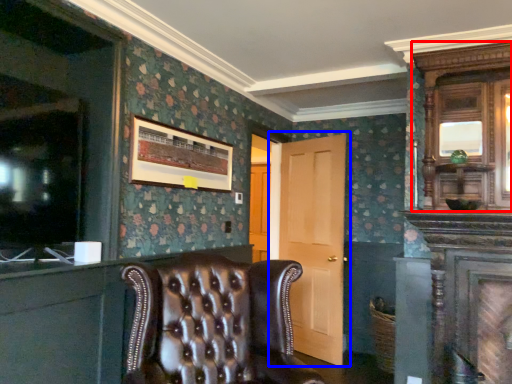
Question: Which of the following is the farthest to the observer, armoire (highlighted by a red box) or door (highlighted by a blue box)?

Choices:
 (A) armoire
 (B) door

Answer: (B)